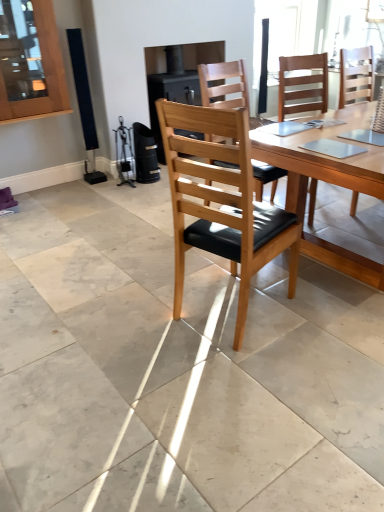
Question: Can you confirm if wooden table at center is smaller than light brown wood chair at center, the second chair in the front-to-back sequence?

Choices:
 (A) no
 (B) yes

Answer: (A)

Question: Is wooden table at center outside light brown wood chair at center, the second chair in the front-to-back sequence?

Choices:
 (A) no
 (B) yes

Answer: (B)

Question: Are wooden table at center and light brown wood chair at center, the second chair in the front-to-back sequence, beside each other?

Choices:
 (A) yes
 (B) no

Answer: (B)

Question: Does wooden table at center turn towards light brown wood chair at center, marked as the second chair in a back-to-front arrangement?

Choices:
 (A) no
 (B) yes

Answer: (A)

Question: From a real-world perspective, does wooden table at center sit lower than light brown wood chair at center, the second chair in the front-to-back sequence?

Choices:
 (A) yes
 (B) no

Answer: (A)

Question: Is wooden table at center turned away from light brown wood chair at center, marked as the second chair in a back-to-front arrangement?

Choices:
 (A) no
 (B) yes

Answer: (A)

Question: Is wooden chair with black cushion at center, the first chair viewed from the front, positioned with its back to wooden table at center?

Choices:
 (A) yes
 (B) no

Answer: (B)

Question: Is wooden chair with black cushion at center, the first chair viewed from the front, not near wooden table at center?

Choices:
 (A) no
 (B) yes

Answer: (A)

Question: Would you say wooden chair with black cushion at center, which is the third chair from back to front, contains wooden table at center?

Choices:
 (A) no
 (B) yes

Answer: (A)

Question: Does wooden chair with black cushion at center, which is the third chair from back to front, have a lesser width compared to wooden table at center?

Choices:
 (A) no
 (B) yes

Answer: (B)

Question: Considering the relative positions of wooden chair with black cushion at center, which is the third chair from back to front, and wooden table at center in the image provided, is wooden chair with black cushion at center, which is the third chair from back to front, to the left of wooden table at center from the viewer's perspective?

Choices:
 (A) yes
 (B) no

Answer: (A)

Question: Does wooden chair with black cushion at center, the first chair viewed from the front, have a larger size compared to wooden table at center?

Choices:
 (A) no
 (B) yes

Answer: (A)

Question: Can you confirm if wooden table at center is positioned to the right of wooden chair with black cushion at center, which is the third chair from back to front?

Choices:
 (A) yes
 (B) no

Answer: (A)